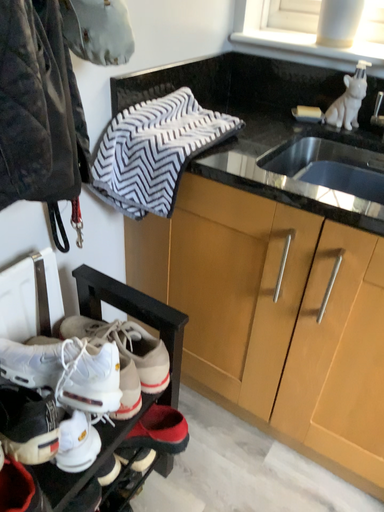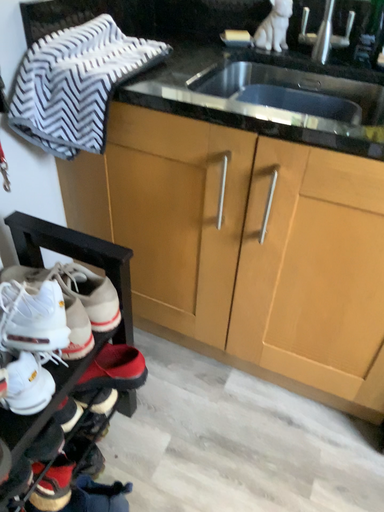
Question: How did the camera likely rotate when shooting the video?

Choices:
 (A) rotated right
 (B) rotated left

Answer: (A)